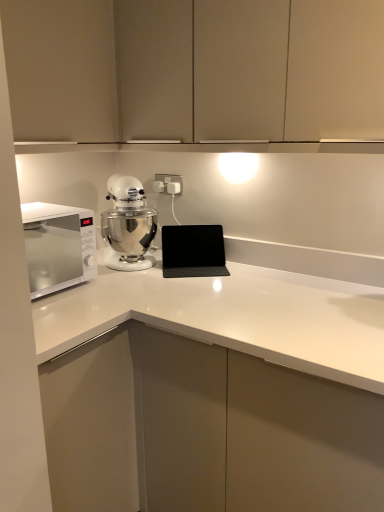
Question: Is silver metallic mixer at center taller than matte beige cabinets at upper center, arranged as the second cabinetry when viewed from the left?

Choices:
 (A) no
 (B) yes

Answer: (A)

Question: Is silver metallic mixer at center turned away from matte beige cabinets at upper center, the 1th cabinetry positioned from the right?

Choices:
 (A) no
 (B) yes

Answer: (A)

Question: From a real-world perspective, is silver metallic mixer at center on top of matte beige cabinets at upper center, arranged as the second cabinetry when viewed from the left?

Choices:
 (A) yes
 (B) no

Answer: (B)

Question: Is silver metallic mixer at center oriented towards matte beige cabinets at upper center, the 1th cabinetry positioned from the right?

Choices:
 (A) yes
 (B) no

Answer: (B)

Question: Does silver metallic mixer at center come in front of matte beige cabinets at upper center, arranged as the second cabinetry when viewed from the left?

Choices:
 (A) yes
 (B) no

Answer: (B)

Question: From a real-world perspective, is silver metallic mixer at center located beneath matte beige cabinets at upper center, arranged as the second cabinetry when viewed from the left?

Choices:
 (A) yes
 (B) no

Answer: (A)

Question: Is matte beige cabinet at upper left, acting as the 2th cabinetry starting from the right, located outside silver metallic mixer at center?

Choices:
 (A) yes
 (B) no

Answer: (A)

Question: Can you confirm if matte beige cabinet at upper left, acting as the 2th cabinetry starting from the right, is smaller than silver metallic mixer at center?

Choices:
 (A) no
 (B) yes

Answer: (A)

Question: From the image's perspective, would you say matte beige cabinet at upper left, acting as the 2th cabinetry starting from the right, is shown under silver metallic mixer at center?

Choices:
 (A) yes
 (B) no

Answer: (B)

Question: Considering the relative positions of matte beige cabinet at upper left, acting as the 2th cabinetry starting from the right, and silver metallic mixer at center in the image provided, is matte beige cabinet at upper left, acting as the 2th cabinetry starting from the right, to the left of silver metallic mixer at center from the viewer's perspective?

Choices:
 (A) no
 (B) yes

Answer: (B)

Question: Can you confirm if matte beige cabinet at upper left, acting as the 2th cabinetry starting from the right, is bigger than silver metallic mixer at center?

Choices:
 (A) yes
 (B) no

Answer: (A)

Question: From a real-world perspective, is matte beige cabinet at upper left, acting as the 2th cabinetry starting from the right, under silver metallic mixer at center?

Choices:
 (A) yes
 (B) no

Answer: (B)

Question: Is there a large distance between white glossy microwave at left and matte beige cabinets at upper center, arranged as the second cabinetry when viewed from the left?

Choices:
 (A) yes
 (B) no

Answer: (B)